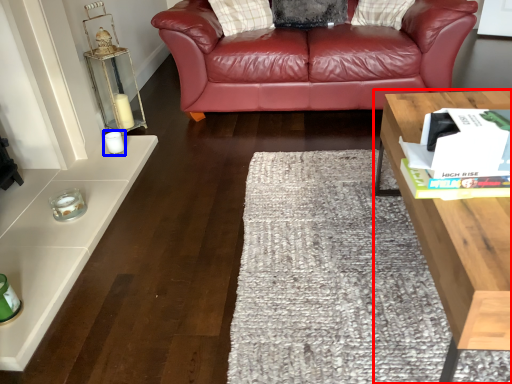
Question: Among these objects, which one is farthest to the camera, table (highlighted by a red box) or candle holder (highlighted by a blue box)?

Choices:
 (A) table
 (B) candle holder

Answer: (B)